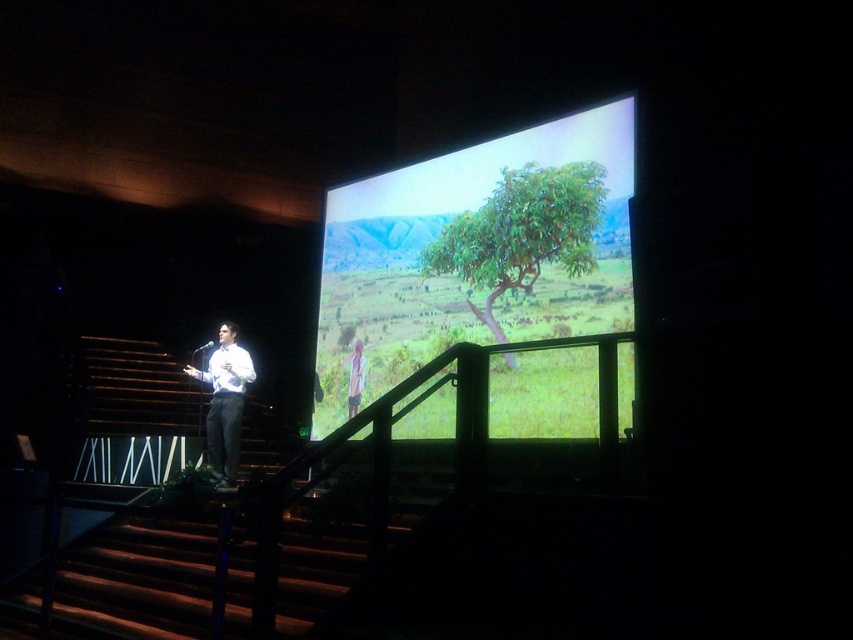
Describe the element at coordinates (224, 403) in the screenshot. I see `white shirt at center` at that location.

Based on the photo, who is shorter, white shirt at center or light brown fabric shirt at center?

light brown fabric shirt at center is shorter.

This screenshot has width=853, height=640. Describe the element at coordinates (224, 403) in the screenshot. I see `white shirt at center` at that location.

Where is `white shirt at center`? white shirt at center is located at coordinates (224, 403).

Does dark wood stairs at lower left have a smaller size compared to green leafy tree at center?

Correct, dark wood stairs at lower left occupies less space than green leafy tree at center.

Between point (109, 576) and point (532, 273), which one is positioned in front?

Point (109, 576)

What do you see at coordinates (137, 580) in the screenshot?
I see `dark wood stairs at lower left` at bounding box center [137, 580].

Find the location of a particular element. This screenshot has height=640, width=853. dark wood stairs at lower left is located at coordinates (137, 580).

Is green leafy tree at center closer to camera compared to light brown fabric shirt at center?

Yes, green leafy tree at center is closer to the viewer.

Does green leafy tree at center appear over light brown fabric shirt at center?

Yes.

At what (x,y) coordinates should I click in order to perform the action: click on green leafy tree at center. Please return your answer as a coordinate pair (x, y). The width and height of the screenshot is (853, 640). Looking at the image, I should click on (521, 232).

Image resolution: width=853 pixels, height=640 pixels. What are the coordinates of `green leafy tree at center` in the screenshot? It's located at (521, 232).